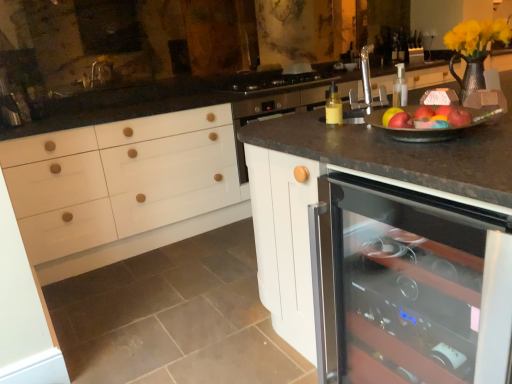
The height and width of the screenshot is (384, 512). What do you see at coordinates (401, 121) in the screenshot?
I see `red matte apple at upper right, arranged as the first apple when viewed from the left` at bounding box center [401, 121].

Describe the element at coordinates (410, 286) in the screenshot. The width and height of the screenshot is (512, 384). I see `transparent glass wine cooler at center` at that location.

Find the location of `black glass gas stove at center`. black glass gas stove at center is located at coordinates (274, 82).

I want to click on yellow matte bottle at right, so click(x=333, y=107).

At what (x,y) coordinates should I click in order to perform the action: click on red matte apple at upper right, arranged as the first apple when viewed from the left. Please return your answer as a coordinate pair (x, y). The image size is (512, 384). Looking at the image, I should click on (401, 121).

Does black glass gas stove at center turn towards red matte apple at upper right, the 3th apple viewed from the right?

Yes, black glass gas stove at center faces towards red matte apple at upper right, the 3th apple viewed from the right.

Does point (222, 82) come behind point (410, 117)?

Yes, point (222, 82) is farther from viewer.

Would you say black glass gas stove at center is outside red matte apple at upper right, the 3th apple viewed from the right?

Yes, black glass gas stove at center is not within red matte apple at upper right, the 3th apple viewed from the right.

Is black glass gas stove at center to the left or to the right of red matte apple at upper right, the 3th apple viewed from the right, in the image?

In the image, black glass gas stove at center appears on the left side of red matte apple at upper right, the 3th apple viewed from the right.

Is transparent glass wine cooler at center positioned with its back to yellow matte flower at upper right?

No.

Based on the photo, does transparent glass wine cooler at center lie behind yellow matte flower at upper right?

No, transparent glass wine cooler at center is in front of yellow matte flower at upper right.

From the image's perspective, which is above, transparent glass wine cooler at center or yellow matte flower at upper right?

yellow matte flower at upper right.

Image resolution: width=512 pixels, height=384 pixels. In order to click on flower located on the right of transparent glass wine cooler at center in this screenshot , I will do click(502, 31).

Which object is further away from the camera, yellow matte flower at upper right or red matte apple at upper right, arranged as the first apple when viewed from the left?

yellow matte flower at upper right is further from the camera.

From the picture: Between yellow matte flower at upper right and red matte apple at upper right, arranged as the first apple when viewed from the left, which one appears on the right side from the viewer's perspective?

yellow matte flower at upper right.

From the picture: Is yellow matte flower at upper right far away from red matte apple at upper right, arranged as the first apple when viewed from the left?

No.

Where is `the 3rd apple to the left of the yellow matte flower at upper right, counting from the anchor's position`? the 3rd apple to the left of the yellow matte flower at upper right, counting from the anchor's position is located at coordinates (401, 121).

From the image's perspective, is transparent glass wine cooler at center located above yellow matte bottle at right?

No.

Could you tell me if transparent glass wine cooler at center is turned towards yellow matte bottle at right?

No, transparent glass wine cooler at center does not turn towards yellow matte bottle at right.

Considering the sizes of objects transparent glass wine cooler at center and yellow matte bottle at right in the image provided, who is thinner, transparent glass wine cooler at center or yellow matte bottle at right?

yellow matte bottle at right.

Consider the image. Is there a large distance between transparent glass wine cooler at center and yellow matte bottle at right?

No.

Can you confirm if black glass gas stove at center is shorter than yellow matte flower at upper right?

Indeed, black glass gas stove at center has a lesser height compared to yellow matte flower at upper right.

Is black glass gas stove at center facing away from yellow matte flower at upper right?

black glass gas stove at center does not have its back to yellow matte flower at upper right.

Is black glass gas stove at center with yellow matte flower at upper right?

black glass gas stove at center and yellow matte flower at upper right are clearly separated.

Is the position of black glass gas stove at center more distant than that of yellow matte flower at upper right?

No.

Considering the relative sizes of red matte apple at upper right, the 3th apple in the left-to-right sequence, and red matte apple at right, marked as the 2th apple in a left-to-right arrangement, in the image provided, is red matte apple at upper right, the 3th apple in the left-to-right sequence, wider than red matte apple at right, marked as the 2th apple in a left-to-right arrangement,?

In fact, red matte apple at upper right, the 3th apple in the left-to-right sequence, might be narrower than red matte apple at right, marked as the 2th apple in a left-to-right arrangement.

Which point is more distant from viewer, (467, 113) or (384, 119)?

The point (384, 119) is behind.

Between red matte apple at upper right, the 3th apple in the left-to-right sequence, and red matte apple at right, marked as the 2th apple in a left-to-right arrangement, which one has less height?

With less height is red matte apple at upper right, the 3th apple in the left-to-right sequence.

Which is in front, red matte apple at upper right, the 3th apple in the left-to-right sequence, or red matte apple at right, which is the 2th apple in right-to-left order?

red matte apple at upper right, the 3th apple in the left-to-right sequence, is in front.

Is red matte apple at right, which is the 2th apple in right-to-left order, taller or shorter than black glass gas stove at center?

Considering their sizes, red matte apple at right, which is the 2th apple in right-to-left order, has less height than black glass gas stove at center.

Which is more to the right, red matte apple at right, which is the 2th apple in right-to-left order, or black glass gas stove at center?

red matte apple at right, which is the 2th apple in right-to-left order, is more to the right.

At what (x,y) coordinates should I click in order to perform the action: click on apple that is the 1st one when counting rightward from the black glass gas stove at center. Please return your answer as a coordinate pair (x, y). Image resolution: width=512 pixels, height=384 pixels. Looking at the image, I should click on (401, 121).

Where is `flower that is above the transparent glass wine cooler at center (from a real-world perspective)`? Image resolution: width=512 pixels, height=384 pixels. flower that is above the transparent glass wine cooler at center (from a real-world perspective) is located at coordinates (502, 31).

Considering their positions, is red matte apple at right, which is the 2th apple in right-to-left order, positioned further to yellow matte bottle at right than red matte apple at upper right, the 1th apple from the right?

red matte apple at upper right, the 1th apple from the right, is positioned further to the anchor yellow matte bottle at right.

When comparing their distances from red matte apple at upper right, the 1th apple from the right, does black glass gas stove at center or red matte apple at upper right, the 3th apple viewed from the right, seem closer?

red matte apple at upper right, the 3th apple viewed from the right, lies closer to red matte apple at upper right, the 1th apple from the right, than the other object.

Looking at the image, which one is located further to yellow matte bottle at right, red matte apple at upper right, the 3th apple viewed from the right, or red matte apple at right, marked as the 2th apple in a left-to-right arrangement?

red matte apple at upper right, the 3th apple viewed from the right, is positioned further to the anchor yellow matte bottle at right.

Based on their spatial positions, is red matte apple at upper right, the 1th apple from the right, or red matte apple at right, which is the 2th apple in right-to-left order, further from red matte apple at upper right, the 3th apple viewed from the right?

Based on the image, red matte apple at upper right, the 1th apple from the right, appears to be further to red matte apple at upper right, the 3th apple viewed from the right.

Estimate the real-world distances between objects in this image. Which object is closer to yellow matte flower at upper right, red matte apple at right, marked as the 2th apple in a left-to-right arrangement, or yellow matte bottle at right?

red matte apple at right, marked as the 2th apple in a left-to-right arrangement.

When comparing their distances from red matte apple at right, marked as the 2th apple in a left-to-right arrangement, does red matte apple at upper right, the 3th apple viewed from the right, or black glass gas stove at center seem closer?

red matte apple at upper right, the 3th apple viewed from the right.

Estimate the real-world distances between objects in this image. Which object is further from red matte apple at upper right, arranged as the first apple when viewed from the left, yellow matte bottle at right or transparent glass wine cooler at center?

The object further to red matte apple at upper right, arranged as the first apple when viewed from the left, is transparent glass wine cooler at center.

In the scene shown: Which object lies further to the anchor point red matte apple at upper right, arranged as the first apple when viewed from the left, yellow matte flower at upper right or yellow matte bottle at right?

yellow matte flower at upper right is positioned further to the anchor red matte apple at upper right, arranged as the first apple when viewed from the left.

Image resolution: width=512 pixels, height=384 pixels. In order to click on bottle between transparent glass wine cooler at center and black glass gas stove at center along the z-axis in this screenshot , I will do `click(333, 107)`.

The height and width of the screenshot is (384, 512). In order to click on apple between red matte apple at upper right, arranged as the first apple when viewed from the left, and black glass gas stove at center from front to back in this screenshot , I will do `click(390, 115)`.

Where is `gas stove between red matte apple at upper right, the 3th apple in the left-to-right sequence, and yellow matte flower at upper right from front to back`? This screenshot has width=512, height=384. gas stove between red matte apple at upper right, the 3th apple in the left-to-right sequence, and yellow matte flower at upper right from front to back is located at coordinates (274, 82).

At what (x,y) coordinates should I click in order to perform the action: click on bottle between red matte apple at right, marked as the 2th apple in a left-to-right arrangement, and yellow matte flower at upper right, along the z-axis. Please return your answer as a coordinate pair (x, y). The width and height of the screenshot is (512, 384). Looking at the image, I should click on (333, 107).